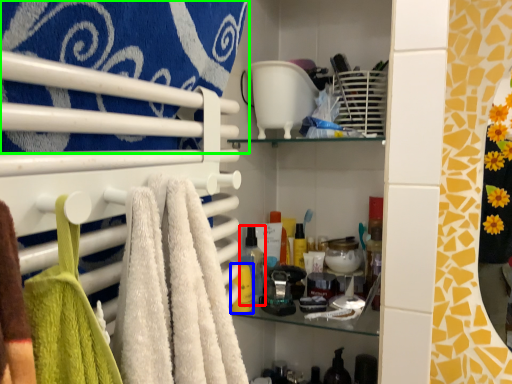
Question: Based on their relative distances, which object is farther from toiletry (highlighted by a red box)? Choose from toiletry (highlighted by a blue box) and towel (highlighted by a green box).

Choices:
 (A) toiletry
 (B) towel

Answer: (B)